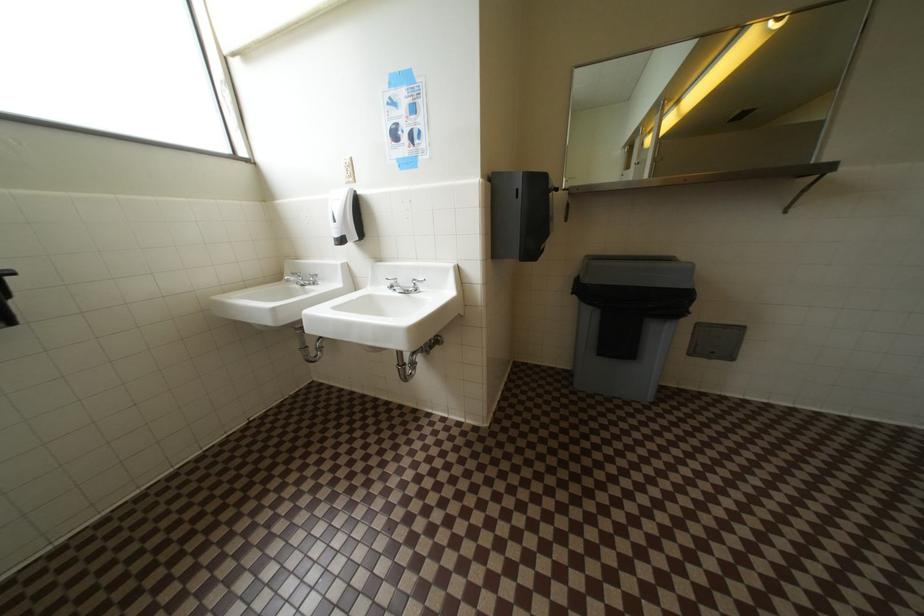
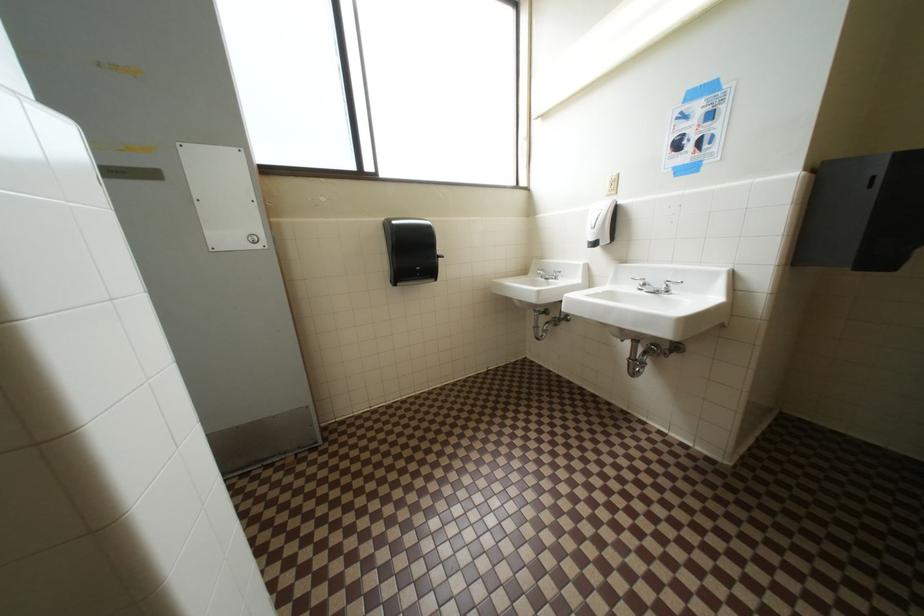
Question: The camera is either moving clockwise (left) or counter-clockwise (right) around the object. The first image is from the beginning of the video and the second image is from the end. Is the camera moving left or right when shooting the video?

Choices:
 (A) Left
 (B) Right

Answer: (B)